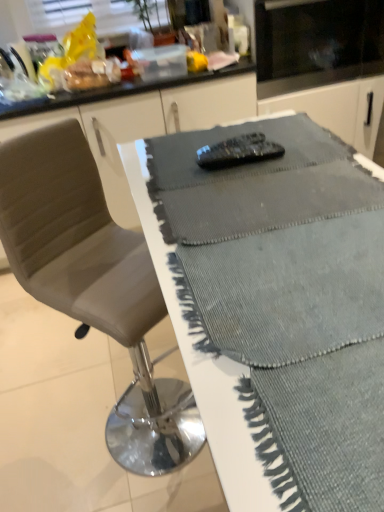
Where is `vacant region above leather-like gray chair at center (from a real-world perspective)`? The height and width of the screenshot is (512, 384). vacant region above leather-like gray chair at center (from a real-world perspective) is located at coordinates (77, 387).